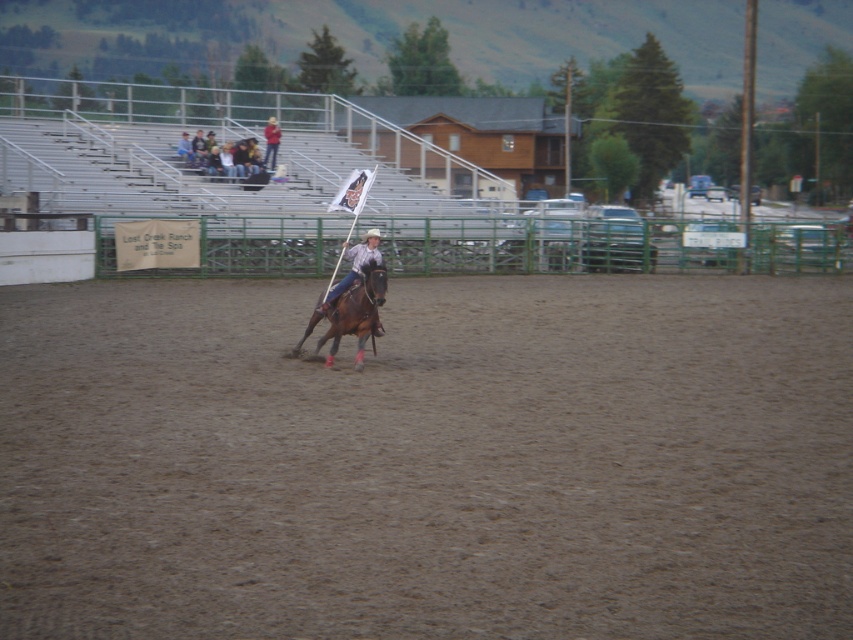
Looking at this image, you are a photographer positioned at the edge of the rodeo arena. You want to take a photo of the matte brown horse at center but also include the denim jacket at upper left in the frame. Which object should you focus on first to ensure both are in focus?

You should focus on the denim jacket at upper left first because it is closer to you than the matte brown horse at center, so focusing on the closer object will help ensure both are in focus.

You are a photographer at the rodeo event. You want to capture a photo of the light brown leather jacket at upper center without the brown sandy dirt at center appearing in the foreground. Is this possible based on their positions?

The brown sandy dirt at center is not as tall as the light brown leather jacket at upper center, so the jacket is taller. Therefore, if the photographer positions themselves appropriately, they can angle the camera to focus on the jacket while avoiding the dirt in the foreground.

You are a photographer at the rodeo event. You need to capture a photo that includes both the matte brown horse at center and the light brown leather jacket at upper center. Which object should you focus on first to ensure both are in frame?

The matte brown horse at center has a lesser width compared to the light brown leather jacket at upper center. Therefore, you should focus on the light brown leather jacket at upper center first since it is wider and will require more space in the frame to ensure both objects are captured properly.